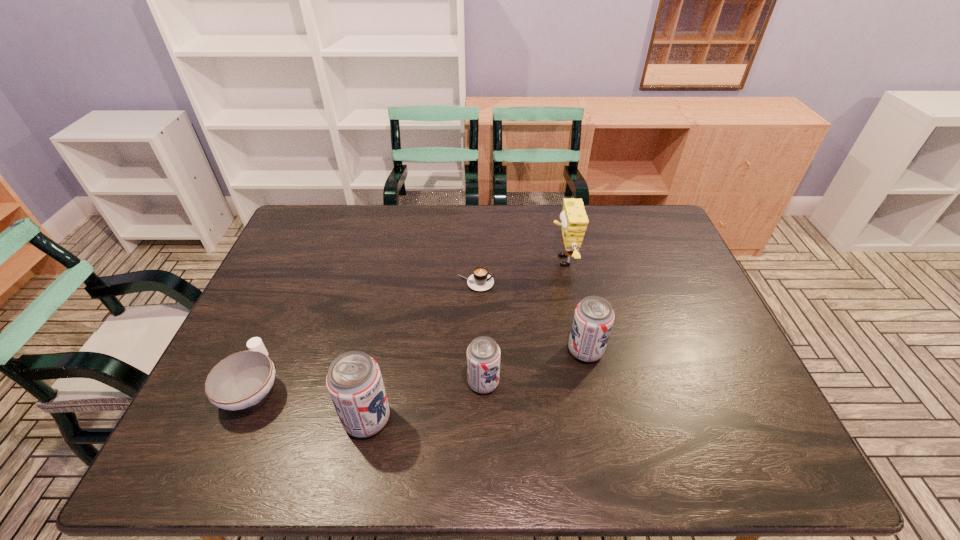
Select which beer can is the closest to the leftmost object. Please provide its 2D coordinates. Your answer should be formatted as a tuple, i.e. [(x, y)], where the tuple contains the x and y coordinates of a point satisfying the conditions above.

[(354, 381)]

You are a GUI agent. You are given a task and a screenshot of the screen. Output one action in this format:
    pyautogui.click(x=<x>, y=<y>)
    Task: Click on the beer can that is the second closest to the cappuccino
    
    Given the screenshot: What is the action you would take?
    pyautogui.click(x=483, y=354)

This screenshot has width=960, height=540. Find the location of `free location that satisfies the following two spatial constraints: 1. on the side with the handle of the second tallest beer can; 2. on the right side of the second shortest object`. free location that satisfies the following two spatial constraints: 1. on the side with the handle of the second tallest beer can; 2. on the right side of the second shortest object is located at coordinates (270, 350).

Locate an element on the screen. free space that satisfies the following two spatial constraints: 1. on the side with the handle of the rightmost beer can; 2. on the right side of the chinaware is located at coordinates (270, 350).

Find the location of a particular element. The width and height of the screenshot is (960, 540). blank space that satisfies the following two spatial constraints: 1. on the side with the handle of the leftmost object; 2. on the right side of the second nearest beer can is located at coordinates (255, 382).

Where is `vacant space that satisfies the following two spatial constraints: 1. on the back side of the third tallest object; 2. on the left side of the fifth object from right to left`? vacant space that satisfies the following two spatial constraints: 1. on the back side of the third tallest object; 2. on the left side of the fifth object from right to left is located at coordinates (381, 350).